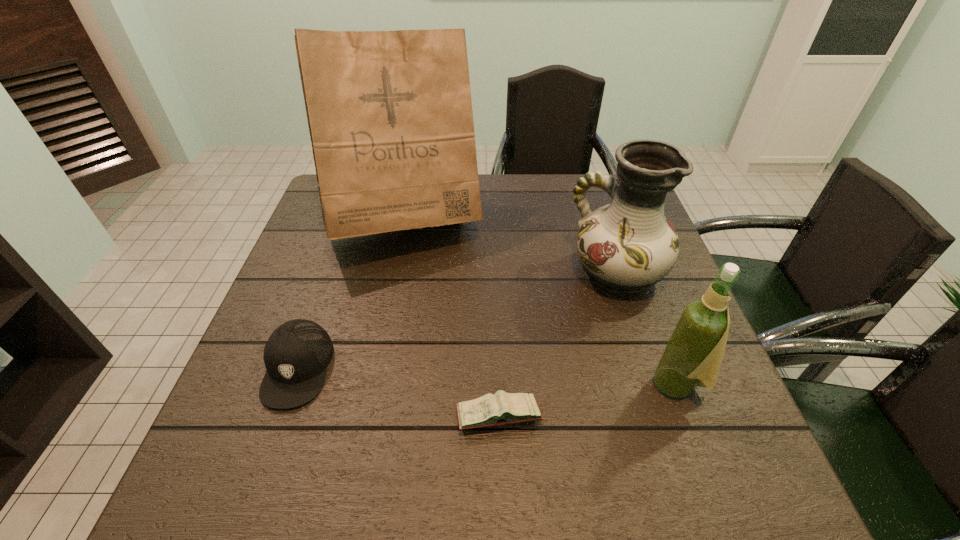
This screenshot has height=540, width=960. In order to click on free space located on the front-facing side of the fourth tallest object in this screenshot , I will do `click(255, 488)`.

The image size is (960, 540). In order to click on vacant space positioned on the left of the shortest object in this screenshot , I will do `click(297, 416)`.

Locate an element on the screen. This screenshot has height=540, width=960. object that is at the far edge is located at coordinates (390, 117).

Identify the location of grocery bag that is at the left edge. The height and width of the screenshot is (540, 960). (390, 117).

This screenshot has width=960, height=540. In order to click on cap at the left edge in this screenshot , I will do `click(296, 355)`.

Identify the location of vase that is at the right edge. This screenshot has width=960, height=540. pos(628,245).

This screenshot has width=960, height=540. Find the location of `wine bottle that is at the right edge`. wine bottle that is at the right edge is located at coordinates (693, 355).

Locate an element on the screen. object positioned at the far left corner is located at coordinates tap(390, 117).

I want to click on free space at the far edge of the desktop, so click(x=496, y=201).

Find the location of a particular element. The height and width of the screenshot is (540, 960). free space at the near edge of the desktop is located at coordinates (559, 455).